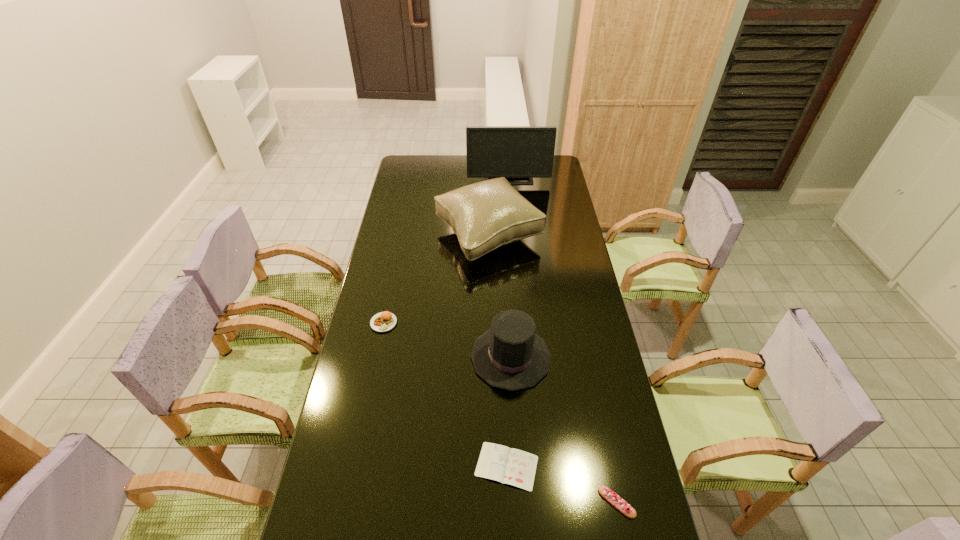
The height and width of the screenshot is (540, 960). Find the location of `vacant position in the image that satisfies the following two spatial constraints: 1. on the front of the dress hat with the decoration; 2. on the right side of the fifth tallest object`. vacant position in the image that satisfies the following two spatial constraints: 1. on the front of the dress hat with the decoration; 2. on the right side of the fifth tallest object is located at coordinates (519, 502).